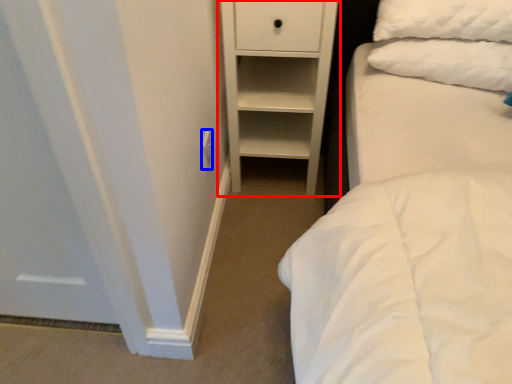
Question: Among these objects, which one is nearest to the camera, chest of drawers (highlighted by a red box) or electric outlet (highlighted by a blue box)?

Choices:
 (A) chest of drawers
 (B) electric outlet

Answer: (A)